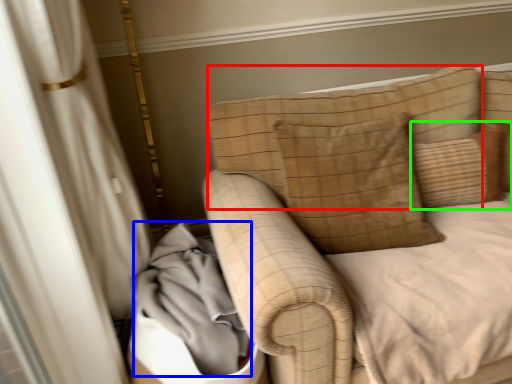
Question: Based on their relative distances, which object is farther from pillow (highlighted by a red box)? Choose from material (highlighted by a blue box) and pillow (highlighted by a green box).

Choices:
 (A) material
 (B) pillow

Answer: (A)